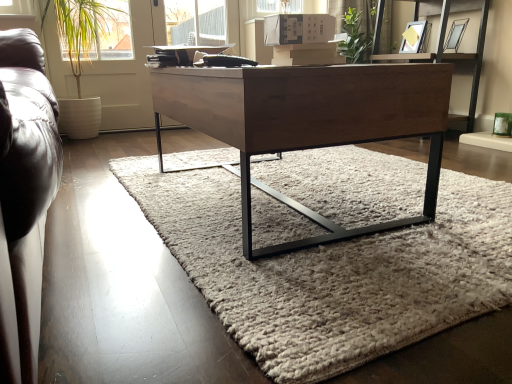
Find the location of a particular element. vacant space behind wooden desk at center is located at coordinates (290, 161).